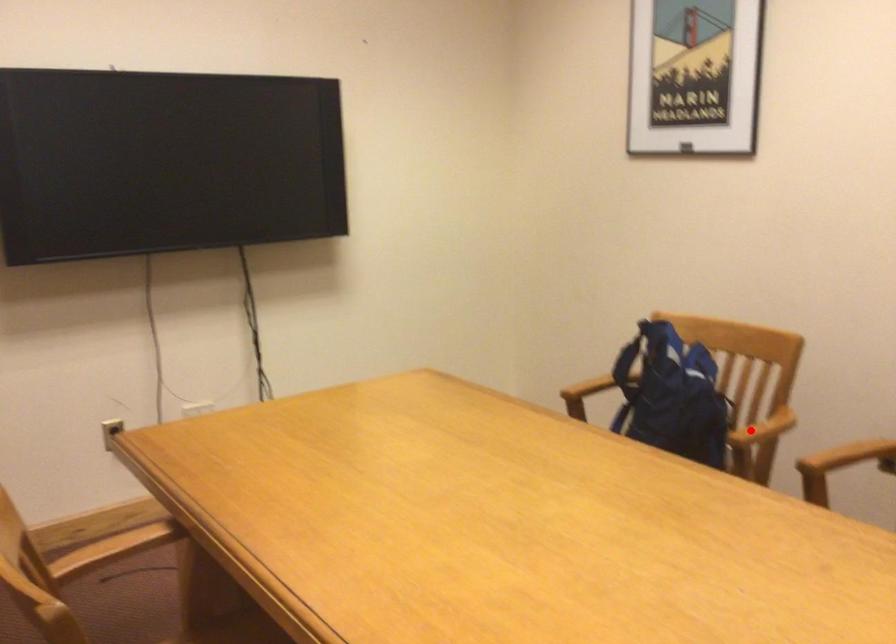
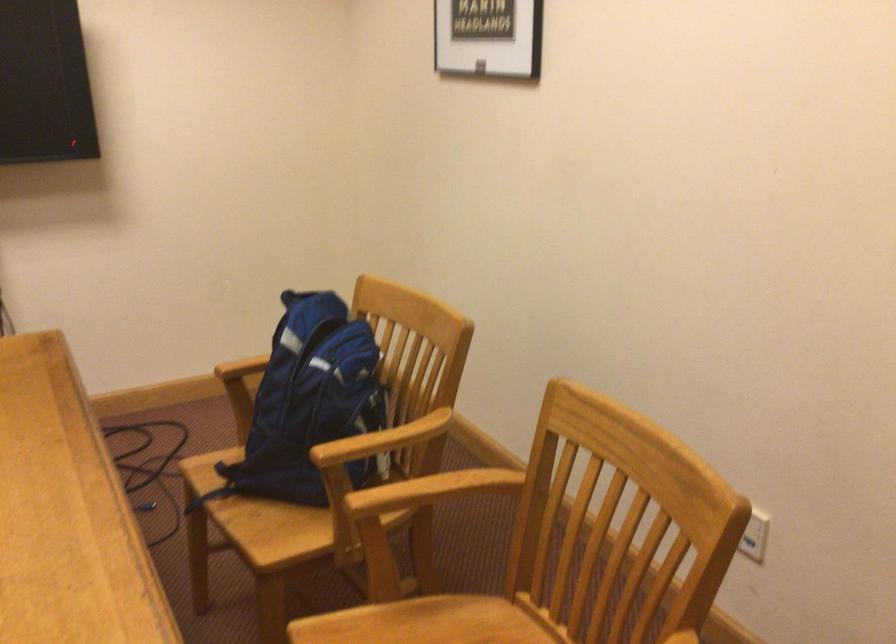
In the second image, find the point that corresponds to the highlighted location in the first image.

(383, 440)